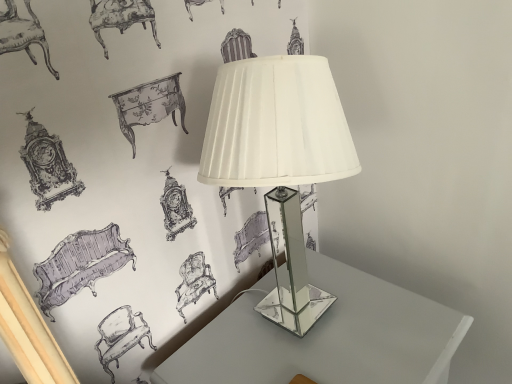
Find the location of a particular element. This screenshot has width=512, height=384. vacant location below clear glass lamp at center (from a real-world perspective) is located at coordinates (294, 327).